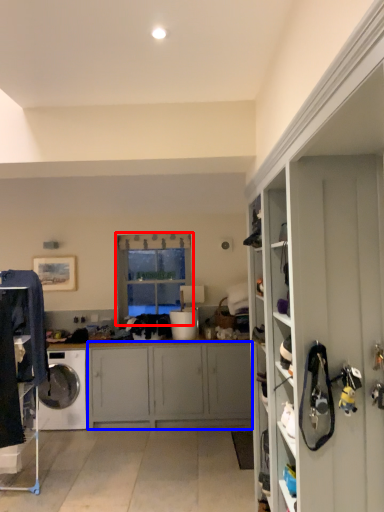
Question: Among these objects, which one is nearest to the camera, window (highlighted by a red box) or cabinetry (highlighted by a blue box)?

Choices:
 (A) window
 (B) cabinetry

Answer: (B)